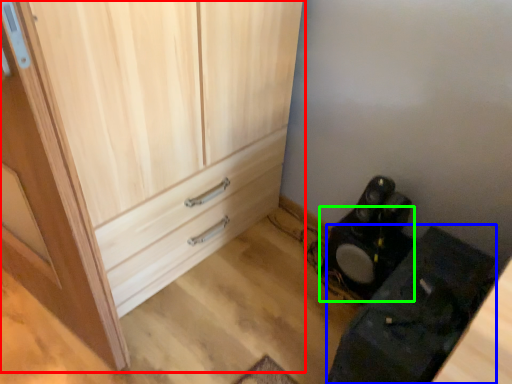
Question: Which object is positioned closest to cupboard (highlighted by a red box)? Select from furniture (highlighted by a blue box) and speaker (highlighted by a green box).

Choices:
 (A) furniture
 (B) speaker

Answer: (B)